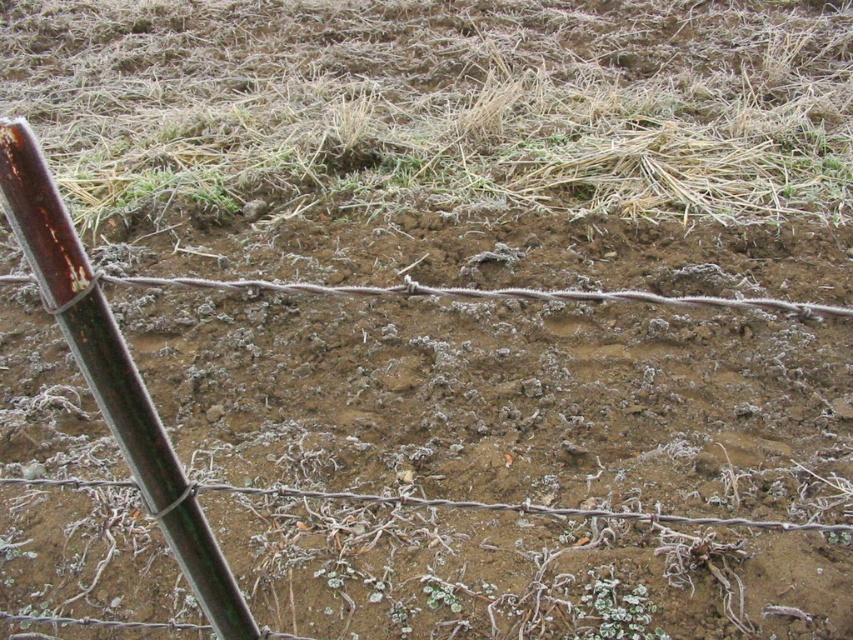
From the picture: You are a farmer checking the frost damage on your field. You notice a spot marked at point [436,106]. What is present at that location?

The frosted dry grass at upper center is located at point [436,106].

You are a farmer checking the fence in your field. You notice the frosted dry grass at upper center and the rusty metal pole at left. Which object takes up more space in the image?

The frosted dry grass at upper center takes up more space in the image than the rusty metal pole at left because it is bigger.

You are a farmer checking the fence in your field. You see the frosted dry grass at upper center and the rusty metal pole at left. Which object is located more to the left?

The frosted dry grass at upper center is positioned on the left side of rusty metal pole at left, so the frosted dry grass at upper center is more to the left.